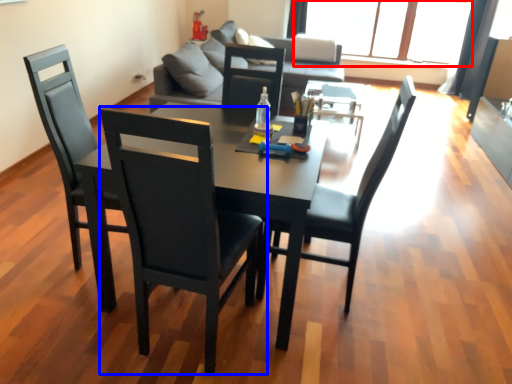
Question: Which object is closer to the camera taking this photo, window (highlighted by a red box) or chair (highlighted by a blue box)?

Choices:
 (A) window
 (B) chair

Answer: (B)